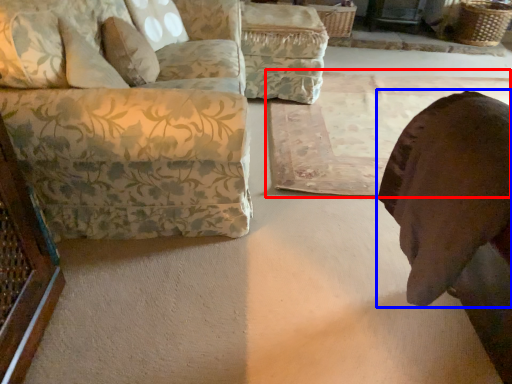
Question: Among these objects, which one is nearest to the camera, mat (highlighted by a red box) or animal (highlighted by a blue box)?

Choices:
 (A) mat
 (B) animal

Answer: (B)